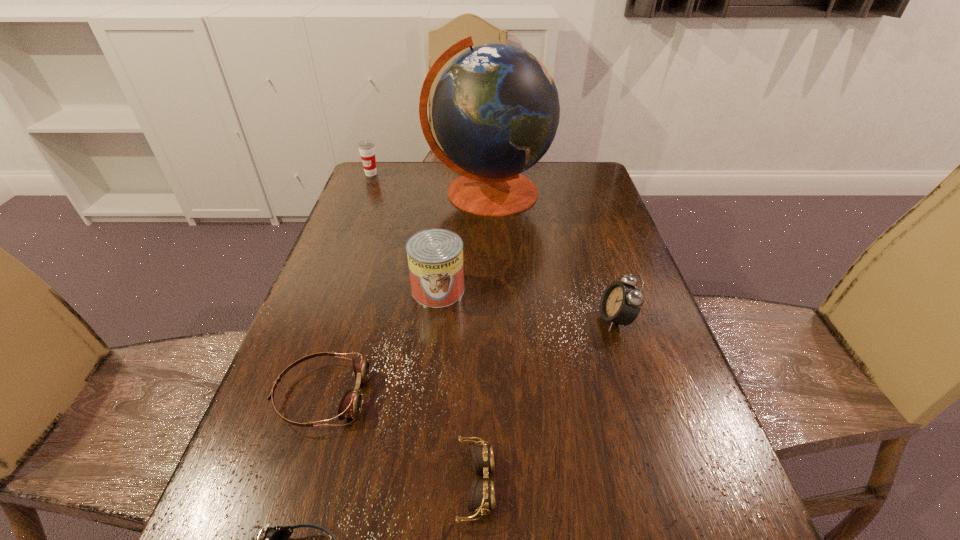
Locate an element on the screen. The height and width of the screenshot is (540, 960). globe is located at coordinates (495, 110).

Image resolution: width=960 pixels, height=540 pixels. In order to click on cup in this screenshot , I will do `click(366, 148)`.

Locate an element on the screen. Image resolution: width=960 pixels, height=540 pixels. can is located at coordinates (435, 256).

The height and width of the screenshot is (540, 960). I want to click on the rightmost object, so click(620, 303).

Find the location of a particular element. The image size is (960, 540). the farthest goggles is located at coordinates (350, 406).

At what (x,y) coordinates should I click in order to perform the action: click on the second farthest goggles. Please return your answer as a coordinate pair (x, y). This screenshot has width=960, height=540. Looking at the image, I should click on (482, 493).

Find the location of a particular element. This screenshot has width=960, height=540. the second nearest object is located at coordinates (482, 493).

Identify the location of vacant region located 0.220m with the Americas facing the viewer on the globe. The image size is (960, 540). (491, 274).

The height and width of the screenshot is (540, 960). Find the location of `free location located on the side of the cup with the logo`. free location located on the side of the cup with the logo is located at coordinates (356, 212).

The image size is (960, 540). I want to click on vacant space located 0.080m on the back of the can, so click(x=443, y=253).